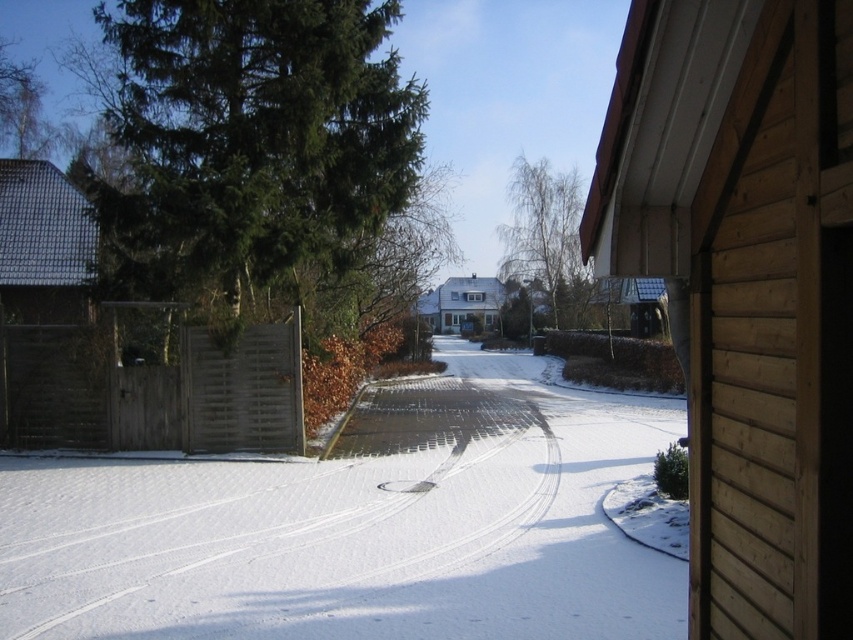
You are standing at the point marked by the coordinate point at point (358, 525). What is the color and texture of the ground beneath your feet?

The ground beneath your feet is white powdery snow at center, which is located at point (358, 525).